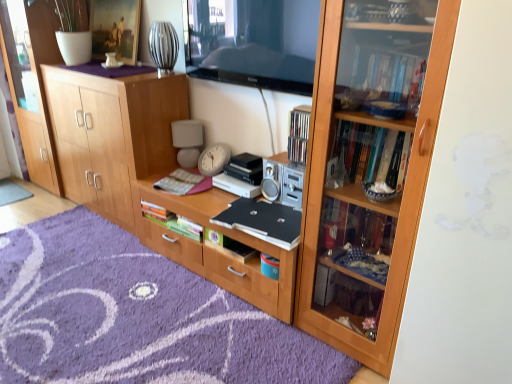
The image size is (512, 384). Describe the element at coordinates (184, 182) in the screenshot. I see `hardcover book at center, placed as the 1th book when sorted from top to bottom` at that location.

You are a GUI agent. You are given a task and a screenshot of the screen. Output one action in this format:
    pyautogui.click(x=<x>, y=<y>)
    Task: Click on the gray fabric doormat at lower left, which appears as the first doormat when viewed from the back
    
    Given the screenshot: What is the action you would take?
    pyautogui.click(x=12, y=192)

The image size is (512, 384). What do you see at coordinates (230, 245) in the screenshot? I see `hardcover book at center, arranged as the 1th book when ordered from the bottom` at bounding box center [230, 245].

What is the approximate width of black matte laptop at center?

14.10 inches.

At what (x,y) coordinates should I click in order to perform the action: click on wooden desk at center. Please return your answer as a coordinate pair (x, y). This screenshot has height=384, width=512. Looking at the image, I should click on (217, 249).

The image size is (512, 384). Describe the element at coordinates (217, 249) in the screenshot. I see `wooden desk at center` at that location.

At what (x,y) coordinates should I click in order to perform the action: click on silver metallic stereo at center. Please return your answer as a coordinate pair (x, y). This screenshot has height=384, width=512. Looking at the image, I should click on (282, 181).

Could you tell me if hardcover book at center, which appears as the 3th book when viewed from the top, is facing hardcover book at center, which ranks as the second book in top-to-bottom order?

No, hardcover book at center, which appears as the 3th book when viewed from the top, is not aimed at hardcover book at center, which ranks as the second book in top-to-bottom order.

Does hardcover book at center, which appears as the 3th book when viewed from the top, have a lesser height compared to hardcover book at center, positioned as the second book in bottom-to-top order?

Correct, hardcover book at center, which appears as the 3th book when viewed from the top, is not as tall as hardcover book at center, positioned as the second book in bottom-to-top order.

Considering the positions of point (221, 240) and point (200, 239), is point (221, 240) closer or farther from the camera than point (200, 239)?

Point (221, 240) is closer to the camera than point (200, 239).

From a real-world perspective, is hardcover book at center, arranged as the 1th book when ordered from the bottom, above or below hardcover book at center, which ranks as the second book in top-to-bottom order?

In terms of real-world spatial position, hardcover book at center, arranged as the 1th book when ordered from the bottom, is above hardcover book at center, which ranks as the second book in top-to-bottom order.

In the image, is wooden bookcase at right positioned in front of or behind transparent wood cabinet at left?

Visually, wooden bookcase at right is located in front of transparent wood cabinet at left.

Where is `bookcase that is above the transparent wood cabinet at left (from a real-world perspective)`? The width and height of the screenshot is (512, 384). bookcase that is above the transparent wood cabinet at left (from a real-world perspective) is located at coordinates (369, 168).

Based on the photo, can you tell me how much wooden bookcase at right and transparent wood cabinet at left differ in facing direction?

There is a 94.5-degree angle between the facing directions of wooden bookcase at right and transparent wood cabinet at left.

From a real-world perspective, which object rests below the other?

hardcover book at center, which appears as the 3th book when viewed from the top, from a real-world perspective.

Where is `the 1st book counting from the left of the silver metallic stereo at center`? the 1st book counting from the left of the silver metallic stereo at center is located at coordinates (230, 245).

Is hardcover book at center, arranged as the 1th book when ordered from the bottom, positioned with its back to silver metallic stereo at center?

hardcover book at center, arranged as the 1th book when ordered from the bottom, is not turned away from silver metallic stereo at center.

Is hardcover book at center, which appears as the 3th book when viewed from the top, touching silver metallic stereo at center?

hardcover book at center, which appears as the 3th book when viewed from the top, and silver metallic stereo at center are not in contact.

Is black matte laptop at center far away from transparent wood cabinet at left?

Yes, black matte laptop at center and transparent wood cabinet at left are located far from each other.

Is point (272, 211) more distant than point (14, 92)?

No, (272, 211) is closer to viewer.

Is the depth of black matte laptop at center less than that of transparent wood cabinet at left?

Yes, black matte laptop at center is in front of transparent wood cabinet at left.

Visually, is black matte laptop at center positioned to the left or to the right of transparent wood cabinet at left?

From the image, it's evident that black matte laptop at center is to the right of transparent wood cabinet at left.

Considering the relative sizes of hardcover book at center, placed as the 1th book when sorted from top to bottom, and transparent wood cabinet at left in the image provided, is hardcover book at center, placed as the 1th book when sorted from top to bottom, thinner than transparent wood cabinet at left?

Indeed, hardcover book at center, placed as the 1th book when sorted from top to bottom, has a lesser width compared to transparent wood cabinet at left.

Is transparent wood cabinet at left surrounded by hardcover book at center, placed as the 1th book when sorted from top to bottom?

No, transparent wood cabinet at left is not surrounded by hardcover book at center, placed as the 1th book when sorted from top to bottom.

From a real-world perspective, which is physically below, hardcover book at center, which ranks as the 3th book in bottom-to-top order, or transparent wood cabinet at left?

hardcover book at center, which ranks as the 3th book in bottom-to-top order, from a real-world perspective.

Is point (166, 186) farther from camera compared to point (31, 163)?

No, (166, 186) is closer to viewer.

Between matte wooden picture frame at upper center and wooden bookcase at right, which one appears on the right side from the viewer's perspective?

wooden bookcase at right.

Is matte wooden picture frame at upper center spatially inside wooden bookcase at right, or outside of it?

The correct answer is: outside.

Is matte wooden picture frame at upper center closer to camera compared to wooden bookcase at right?

No.

Looking at this image, considering the sizes of matte wooden picture frame at upper center and wooden bookcase at right in the image, is matte wooden picture frame at upper center wider or thinner than wooden bookcase at right?

Considering their sizes, matte wooden picture frame at upper center looks slimmer than wooden bookcase at right.

From a real-world perspective, who is located lower, matte white lampshade at center or silver metallic stereo at center?

silver metallic stereo at center, from a real-world perspective.

Considering the sizes of matte white lampshade at center and silver metallic stereo at center in the image, is matte white lampshade at center wider or thinner than silver metallic stereo at center?

In the image, matte white lampshade at center appears to be more narrow than silver metallic stereo at center.

From the image's perspective, which object appears higher, matte white lampshade at center or silver metallic stereo at center?

matte white lampshade at center.

Can you confirm if matte white lampshade at center is shorter than silver metallic stereo at center?

Incorrect, the height of matte white lampshade at center does not fall short of that of silver metallic stereo at center.

There is a hardcover book at center, positioned as the second book in bottom-to-top order. At what (x,y) coordinates should I click in order to perform the action: click on the 1st book above it (from a real-world perspective). Please return your answer as a coordinate pair (x, y). Looking at the image, I should click on (230, 245).

Where is `glass door behind the wooden bookcase at right`? The image size is (512, 384). glass door behind the wooden bookcase at right is located at coordinates (27, 94).

Based on their spatial positions, is hardcover book at center, positioned as the second book in bottom-to-top order, or hardcover book at center, which ranks as the 3th book in bottom-to-top order, closer to transparent wood cabinet at left?

hardcover book at center, which ranks as the 3th book in bottom-to-top order.

Considering their positions, is silver metallic stereo at center positioned closer to transparent wood cabinet at left than purple soft rug at lower center, the 1th doormat ordered from the bottom?

purple soft rug at lower center, the 1th doormat ordered from the bottom, is positioned closer to the anchor transparent wood cabinet at left.

Looking at the image, which one is located further to wooden bookcase at right, matte white lampshade at center or matte wooden picture frame at upper center?

matte wooden picture frame at upper center is further to wooden bookcase at right.

Based on the photo, considering their positions, is gray fabric doormat at lower left, arranged as the 1th doormat when viewed from the top, positioned further to black matte laptop at center than wooden desk at center?

gray fabric doormat at lower left, arranged as the 1th doormat when viewed from the top, is further to black matte laptop at center.

When comparing their distances from hardcover book at center, which appears as the 3th book when viewed from the top, does purple soft rug at lower center, the second doormat from the back, or matte white lampshade at center seem closer?

Based on the image, purple soft rug at lower center, the second doormat from the back, appears to be nearer to hardcover book at center, which appears as the 3th book when viewed from the top.

Which object lies further to the anchor point black matte laptop at center, wooden bookcase at right or silver metallic stereo at center?

wooden bookcase at right is positioned further to the anchor black matte laptop at center.

From the image, which object appears to be nearer to matte white lampshade at center, wooden bookcase at right or hardcover book at center, positioned as the second book in bottom-to-top order?

Based on the image, hardcover book at center, positioned as the second book in bottom-to-top order, appears to be nearer to matte white lampshade at center.

When comparing their distances from hardcover book at center, which ranks as the second book in top-to-bottom order, does matte wooden picture frame at upper center or wooden cabinet at center seem further?

matte wooden picture frame at upper center is further to hardcover book at center, which ranks as the second book in top-to-bottom order.

Where is `desk between hardcover book at center, positioned as the second book in bottom-to-top order, and silver metallic stereo at center`? The image size is (512, 384). desk between hardcover book at center, positioned as the second book in bottom-to-top order, and silver metallic stereo at center is located at coordinates (217, 249).

Locate an element on the screen. The width and height of the screenshot is (512, 384). doormat situated between transparent wood cabinet at left and silver metallic stereo at center from left to right is located at coordinates (136, 316).

The image size is (512, 384). Identify the location of picture frame between transparent wood cabinet at left and hardcover book at center, which appears as the 3th book when viewed from the top. (115, 28).

Locate an element on the screen. desk positioned between black matte laptop at center and hardcover book at center, which ranks as the second book in top-to-bottom order, from near to far is located at coordinates (217, 249).